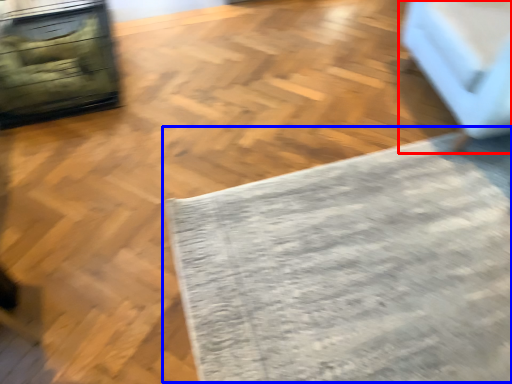
Question: Which point is further to the camera, furniture (highlighted by a red box) or mat (highlighted by a blue box)?

Choices:
 (A) furniture
 (B) mat

Answer: (A)